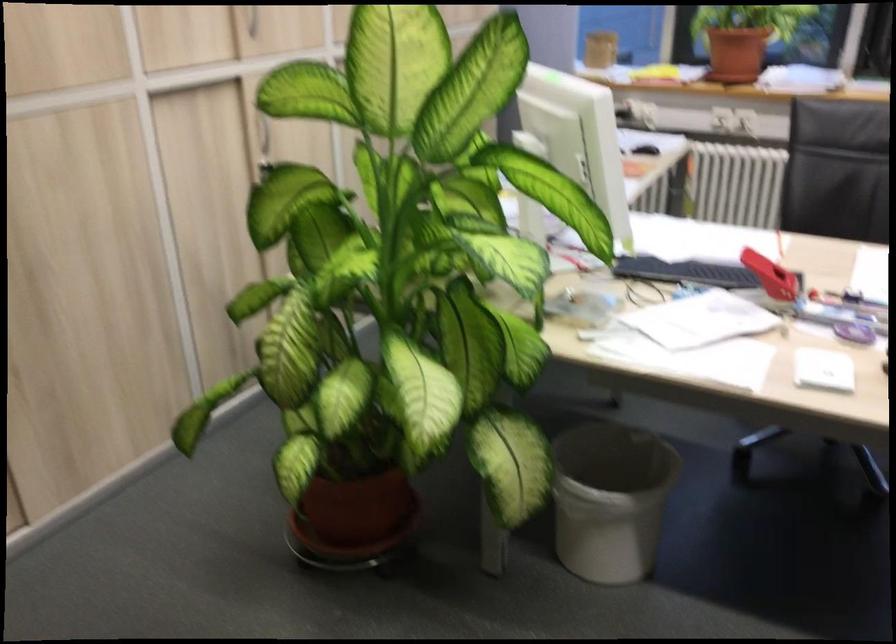
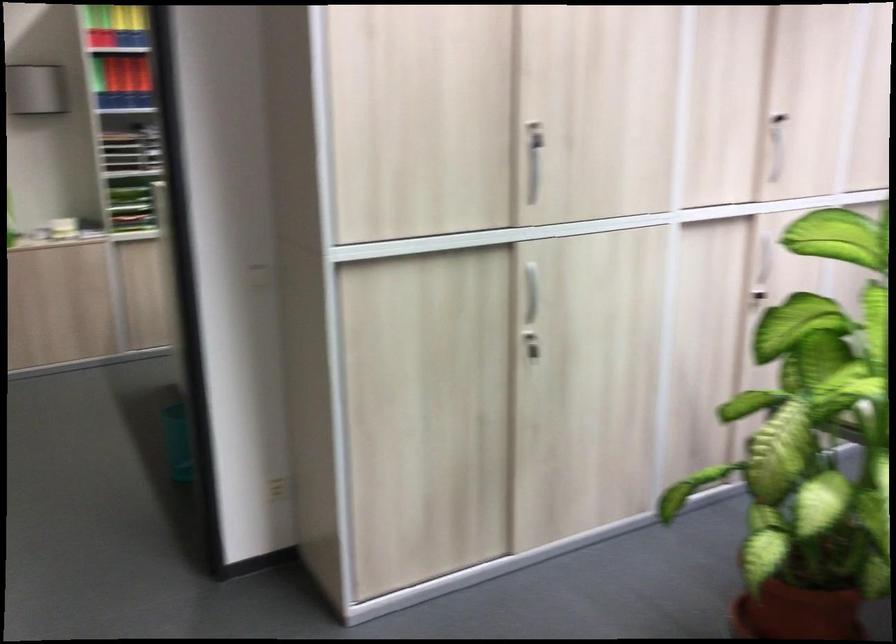
Locate, in the second image, the point that corresponds to point 349,509 in the first image.

(797, 612)